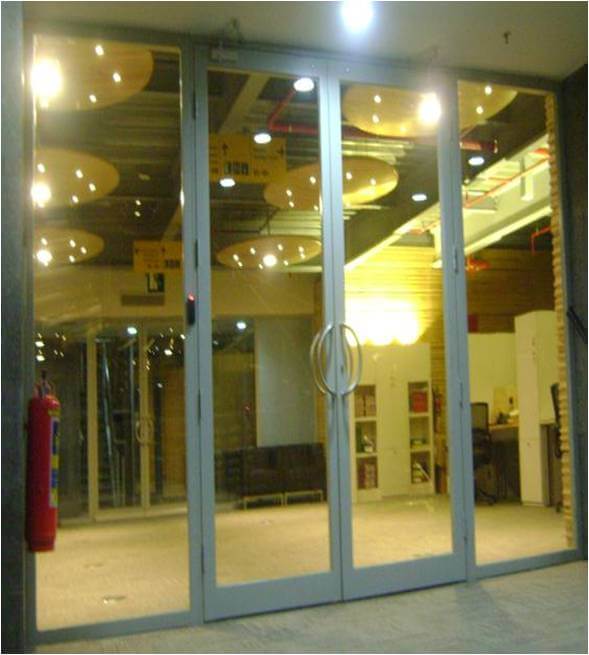
The image size is (589, 655). I want to click on fire extinguisher, so click(x=51, y=496).